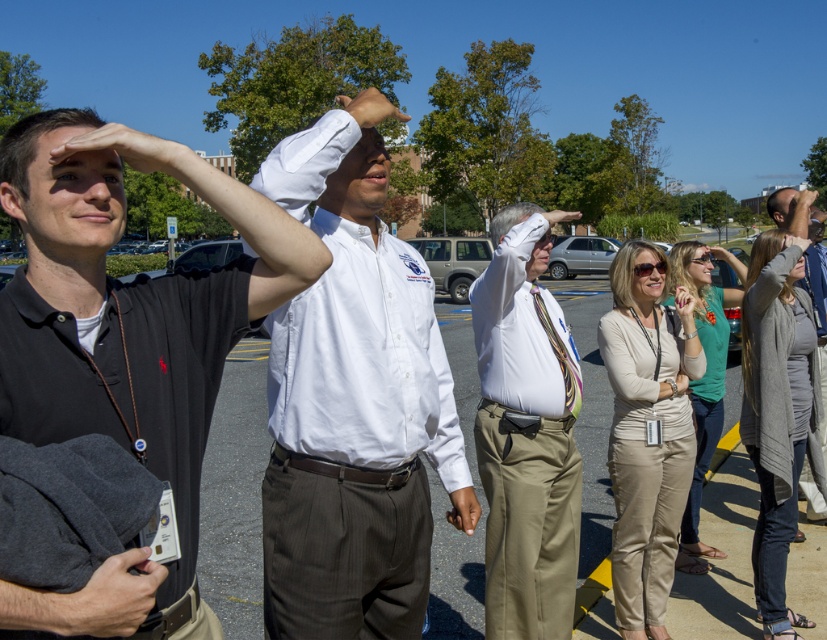
Question: Does white cotton shirt at center appear on the right side of light beige pants at center?

Choices:
 (A) no
 (B) yes

Answer: (A)

Question: Is matte black shirt at left smaller than gray wool cardigan at upper right?

Choices:
 (A) no
 (B) yes

Answer: (B)

Question: Which point is closer to the camera?

Choices:
 (A) light beige pants at center
 (B) matte black shirt at left
 (C) white cotton shirt at center
 (D) gray wool cardigan at upper right

Answer: (B)

Question: Which point is closer to the camera taking this photo?

Choices:
 (A) (491, 381)
 (B) (343, 140)
 (C) (797, 211)

Answer: (B)

Question: Can you confirm if matte black shirt at left is positioned to the left of gray wool cardigan at upper right?

Choices:
 (A) yes
 (B) no

Answer: (A)

Question: Which point appears farthest from the camera in this image?

Choices:
 (A) (380, 561)
 (B) (794, 196)

Answer: (B)